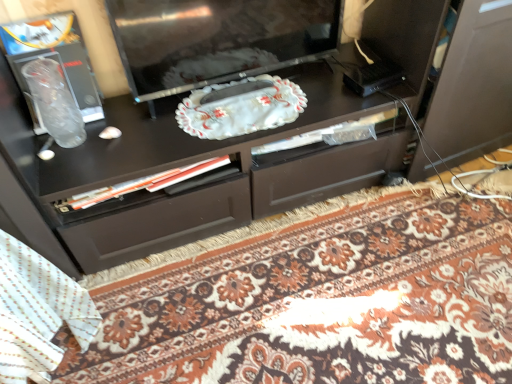
This screenshot has width=512, height=384. What do you see at coordinates (216, 40) in the screenshot?
I see `glossy black television at center` at bounding box center [216, 40].

This screenshot has width=512, height=384. I want to click on glossy black television at center, so click(x=216, y=40).

Where is `white textured blanket at lower left`? Image resolution: width=512 pixels, height=384 pixels. white textured blanket at lower left is located at coordinates (37, 312).

From the image's perspective, is glossy black television at center above or below white textured blanket at lower left?

From the image's perspective, glossy black television at center appears above white textured blanket at lower left.

Identify the location of television behind the white textured blanket at lower left. The width and height of the screenshot is (512, 384). (216, 40).

Is point (326, 33) farther from viewer compared to point (27, 324)?

That is True.

Can you see floral carpet at center touching white textured blanket at lower left?

No, floral carpet at center is not touching white textured blanket at lower left.

Can you tell me how much floral carpet at center and white textured blanket at lower left differ in facing direction?

93.6 degrees separate the facing orientations of floral carpet at center and white textured blanket at lower left.

Which is behind, floral carpet at center or white textured blanket at lower left?

Positioned behind is floral carpet at center.

Is floral carpet at center touching glossy black television at center?

They are not placed beside each other.

Would you say floral carpet at center contains glossy black television at center?

No, glossy black television at center is not a part of floral carpet at center.

Is floral carpet at center aimed at glossy black television at center?

No, floral carpet at center does not turn towards glossy black television at center.

Is the depth of floral carpet at center less than that of glossy black television at center?

Yes.

Would you say white textured blanket at lower left is outside glossy black television at center?

Yes, white textured blanket at lower left is outside of glossy black television at center.

From a real-world perspective, which is physically below, white textured blanket at lower left or glossy black television at center?

white textured blanket at lower left.

Which is more to the right, white textured blanket at lower left or glossy black television at center?

From the viewer's perspective, glossy black television at center appears more on the right side.

Who is shorter, white textured blanket at lower left or glossy black television at center?

glossy black television at center.

In terms of height, does glossy black television at center look taller or shorter compared to floral carpet at center?

In the image, glossy black television at center appears to be taller than floral carpet at center.

Based on their positions, is glossy black television at center located to the left or right of floral carpet at center?

glossy black television at center is to the left of floral carpet at center.

Is there a large distance between glossy black television at center and floral carpet at center?

No.

Looking at this image, from a real-world perspective, between glossy black television at center and floral carpet at center, who is vertically lower?

floral carpet at center.

Does white textured blanket at lower left turn towards floral carpet at center?

No, white textured blanket at lower left does not turn towards floral carpet at center.

Which object is more forward, white textured blanket at lower left or floral carpet at center?

white textured blanket at lower left is in front.

Considering the positions of objects white textured blanket at lower left and floral carpet at center in the image provided, who is more to the right, white textured blanket at lower left or floral carpet at center?

floral carpet at center is more to the right.

Can you confirm if white textured blanket at lower left is bigger than floral carpet at center?

Incorrect, white textured blanket at lower left is not larger than floral carpet at center.

Image resolution: width=512 pixels, height=384 pixels. I want to click on blanket on the left of glossy black television at center, so click(37, 312).

The width and height of the screenshot is (512, 384). I want to click on blanket above the floral carpet at center (from the image's perspective), so pyautogui.click(x=37, y=312).

Based on the photo, when comparing their distances from white textured blanket at lower left, does floral carpet at center or glossy black television at center seem closer?

Based on the image, floral carpet at center appears to be nearer to white textured blanket at lower left.

Estimate the real-world distances between objects in this image. Which object is further from floral carpet at center, glossy black television at center or white textured blanket at lower left?

Based on the image, glossy black television at center appears to be further to floral carpet at center.

Based on their spatial positions, is white textured blanket at lower left or glossy black television at center further from floral carpet at center?

glossy black television at center.

Looking at the image, which one is located closer to glossy black television at center, floral carpet at center or white textured blanket at lower left?

The object closer to glossy black television at center is floral carpet at center.

Based on their spatial positions, is white textured blanket at lower left or floral carpet at center closer to glossy black television at center?

The object closer to glossy black television at center is floral carpet at center.

Considering their positions, is glossy black television at center positioned further to white textured blanket at lower left than floral carpet at center?

glossy black television at center lies further to white textured blanket at lower left than the other object.

This screenshot has width=512, height=384. I want to click on blanket between glossy black television at center and floral carpet at center in the up-down direction, so click(x=37, y=312).